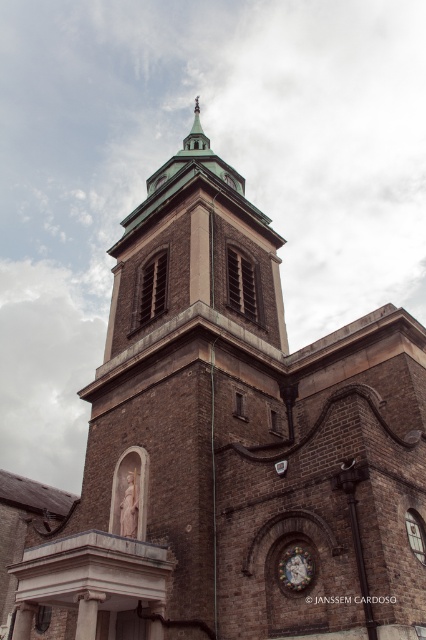
Is matte gold clock at center taller than green metallic spire at upper center?

No.

I want to click on matte gold clock at center, so click(x=296, y=568).